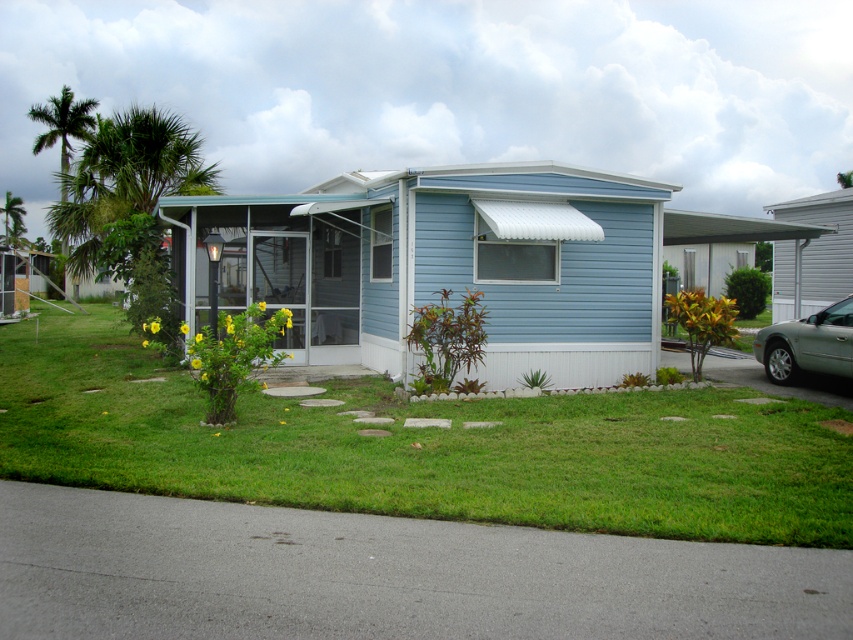
Who is positioned more to the right, green grass lawn at center or green leafy palm tree at upper left?

From the viewer's perspective, green grass lawn at center appears more on the right side.

Based on the photo, can you confirm if green grass lawn at center is bigger than green leafy palm tree at upper left?

Incorrect, green grass lawn at center is not larger than green leafy palm tree at upper left.

Find the location of `green grass lawn at center`. green grass lawn at center is located at coordinates (424, 448).

Who is taller, satin silver car at right or green leafy palm tree at upper left?

green leafy palm tree at upper left

Is point (834, 365) behind point (86, 108)?

That is False.

I want to click on satin silver car at right, so click(807, 344).

What do you see at coordinates (424, 448) in the screenshot? I see `green grass lawn at center` at bounding box center [424, 448].

Is point (96, 406) closer to viewer compared to point (843, 317)?

That is True.

Where is `green grass lawn at center`? Image resolution: width=853 pixels, height=640 pixels. green grass lawn at center is located at coordinates (424, 448).